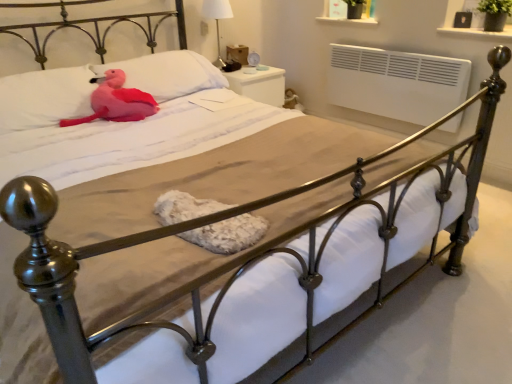
This screenshot has height=384, width=512. What do you see at coordinates (259, 85) in the screenshot?
I see `white glossy nightstand at upper right` at bounding box center [259, 85].

Measure the distance between white glossy nightstand at upper right and camera.

They are 2.91 meters apart.

Locate an element on the screen. The image size is (512, 384). pink plush at upper left, the 2th pillow when ordered from right to left is located at coordinates (44, 98).

Describe the element at coordinates (116, 101) in the screenshot. I see `pink plush toy at upper left` at that location.

The height and width of the screenshot is (384, 512). I want to click on white glossy nightstand at upper right, so click(x=259, y=85).

How much distance is there between matte pink pillow at upper left, acting as the 2th pillow starting from the left, and pink plush toy at upper left?

A distance of 9.90 inches exists between matte pink pillow at upper left, acting as the 2th pillow starting from the left, and pink plush toy at upper left.

Looking at this image, is matte pink pillow at upper left, acting as the 2th pillow starting from the left, far away from pink plush toy at upper left?

They are positioned close to each other.

Which of these two, matte pink pillow at upper left, acting as the 2th pillow starting from the left, or pink plush toy at upper left, stands taller?

With more height is matte pink pillow at upper left, acting as the 2th pillow starting from the left.

How many degrees apart are the facing directions of matte pink pillow at upper left, which is the 1th pillow from right to left, and pink plush toy at upper left?

The angle between the facing direction of matte pink pillow at upper left, which is the 1th pillow from right to left, and the facing direction of pink plush toy at upper left is 4.78 degrees.

Considering the relative positions of pink plush at upper left, which appears as the 1th pillow when viewed from the left, and pink plush toy at upper left in the image provided, is pink plush at upper left, which appears as the 1th pillow when viewed from the left, behind pink plush toy at upper left?

No, the depth of pink plush at upper left, which appears as the 1th pillow when viewed from the left, is less than that of pink plush toy at upper left.

From a real-world perspective, does pink plush at upper left, the 2th pillow when ordered from right to left, stand above pink plush toy at upper left?

Correct, in the physical world, pink plush at upper left, the 2th pillow when ordered from right to left, is higher than pink plush toy at upper left.

Between pink plush at upper left, which appears as the 1th pillow when viewed from the left, and pink plush toy at upper left, which one has smaller size?

Smaller between the two is pink plush toy at upper left.

Which object is positioned more to the right, pink plush at upper left, which appears as the 1th pillow when viewed from the left, or pink plush toy at upper left?

From the viewer's perspective, pink plush toy at upper left appears more on the right side.

Is matte pink pillow at upper left, which is the 1th pillow from right to left, situated inside white fabric lampshade at upper center or outside?

matte pink pillow at upper left, which is the 1th pillow from right to left, exists outside the volume of white fabric lampshade at upper center.

Looking at this image, is there a large distance between matte pink pillow at upper left, acting as the 2th pillow starting from the left, and white fabric lampshade at upper center?

matte pink pillow at upper left, acting as the 2th pillow starting from the left, is near white fabric lampshade at upper center, not far away.

Is matte pink pillow at upper left, acting as the 2th pillow starting from the left, taller than white fabric lampshade at upper center?

No.

Does matte pink pillow at upper left, acting as the 2th pillow starting from the left, have a smaller size compared to white fabric lampshade at upper center?

Incorrect, matte pink pillow at upper left, acting as the 2th pillow starting from the left, is not smaller in size than white fabric lampshade at upper center.

How different are the orientations of white glossy nightstand at upper right and pink plush toy at upper left in degrees?

9.26 degrees.

Does point (236, 76) come behind point (100, 97)?

Yes, it is.

Can you confirm if white glossy nightstand at upper right is positioned to the left of pink plush toy at upper left?

No, white glossy nightstand at upper right is not to the left of pink plush toy at upper left.

Which object is more forward, white fabric lampshade at upper center or matte pink pillow at upper left, acting as the 2th pillow starting from the left?

matte pink pillow at upper left, acting as the 2th pillow starting from the left, is in front.

Find the location of a particular element. This screenshot has height=384, width=512. table lamp that is behind the matte pink pillow at upper left, which is the 1th pillow from right to left is located at coordinates (217, 17).

Which point is more forward, [216,19] or [129,76]?

The point [129,76] is closer.

From a real-world perspective, which is physically below, white fabric lampshade at upper center or matte pink pillow at upper left, which is the 1th pillow from right to left?

matte pink pillow at upper left, which is the 1th pillow from right to left, is physically lower.

Considering the relative sizes of white glossy nightstand at upper right and white fabric lampshade at upper center in the image provided, is white glossy nightstand at upper right bigger than white fabric lampshade at upper center?

Correct, white glossy nightstand at upper right is larger in size than white fabric lampshade at upper center.

Which is in front, point (234, 74) or point (214, 15)?

The point (214, 15) is closer.

Can you confirm if white glossy nightstand at upper right is wider than white fabric lampshade at upper center?

Yes, white glossy nightstand at upper right is wider than white fabric lampshade at upper center.

Which point is more forward, (83, 120) or (228, 12)?

The point (83, 120) is in front.

Who is bigger, pink plush toy at upper left or white fabric lampshade at upper center?

With larger size is pink plush toy at upper left.

Is white fabric lampshade at upper center surrounded by pink plush toy at upper left?

That's incorrect, white fabric lampshade at upper center is not inside pink plush toy at upper left.

The image size is (512, 384). Identify the location of animal in front of the matte pink pillow at upper left, which is the 1th pillow from right to left. point(116,101).

Where is `animal on the right of pink plush at upper left, which appears as the 1th pillow when viewed from the left`? The height and width of the screenshot is (384, 512). animal on the right of pink plush at upper left, which appears as the 1th pillow when viewed from the left is located at coordinates (116, 101).

Based on their spatial positions, is pink plush toy at upper left or pink plush at upper left, which appears as the 1th pillow when viewed from the left, further from white fabric lampshade at upper center?

pink plush at upper left, which appears as the 1th pillow when viewed from the left, is positioned further to the anchor white fabric lampshade at upper center.

When comparing their distances from white fabric lampshade at upper center, does white glossy nightstand at upper right or pink plush at upper left, the 2th pillow when ordered from right to left, seem closer?

Based on the image, white glossy nightstand at upper right appears to be nearer to white fabric lampshade at upper center.

Considering their positions, is pink plush toy at upper left positioned further to white fabric lampshade at upper center than matte pink pillow at upper left, acting as the 2th pillow starting from the left?

pink plush toy at upper left is further to white fabric lampshade at upper center.

When comparing their distances from white fabric lampshade at upper center, does matte pink pillow at upper left, which is the 1th pillow from right to left, or pink plush at upper left, which appears as the 1th pillow when viewed from the left, seem further?

pink plush at upper left, which appears as the 1th pillow when viewed from the left, is positioned further to the anchor white fabric lampshade at upper center.

Estimate the real-world distances between objects in this image. Which object is closer to matte pink pillow at upper left, which is the 1th pillow from right to left, pink plush toy at upper left or pink plush at upper left, which appears as the 1th pillow when viewed from the left?

Among the two, pink plush toy at upper left is located nearer to matte pink pillow at upper left, which is the 1th pillow from right to left.

From the image, which object appears to be farther from matte pink pillow at upper left, which is the 1th pillow from right to left, white fabric lampshade at upper center or pink plush toy at upper left?

Based on the image, white fabric lampshade at upper center appears to be further to matte pink pillow at upper left, which is the 1th pillow from right to left.

From the image, which object appears to be nearer to matte pink pillow at upper left, acting as the 2th pillow starting from the left, pink plush at upper left, the 2th pillow when ordered from right to left, or white fabric lampshade at upper center?

Among the two, pink plush at upper left, the 2th pillow when ordered from right to left, is located nearer to matte pink pillow at upper left, acting as the 2th pillow starting from the left.

Which object lies nearer to the anchor point white fabric lampshade at upper center, matte pink pillow at upper left, which is the 1th pillow from right to left, or pink plush toy at upper left?

Among the two, matte pink pillow at upper left, which is the 1th pillow from right to left, is located nearer to white fabric lampshade at upper center.

The height and width of the screenshot is (384, 512). I want to click on table lamp positioned between pink plush toy at upper left and white glossy nightstand at upper right from near to far, so click(x=217, y=17).

Identify the location of table lamp positioned between matte pink pillow at upper left, acting as the 2th pillow starting from the left, and white glossy nightstand at upper right from near to far. (217, 17).

This screenshot has height=384, width=512. What are the coordinates of `pillow between pink plush toy at upper left and white glossy nightstand at upper right along the z-axis` in the screenshot? It's located at (168, 74).

Locate an element on the screen. pillow between pink plush at upper left, the 2th pillow when ordered from right to left, and white fabric lampshade at upper center in the front-back direction is located at coordinates (168, 74).